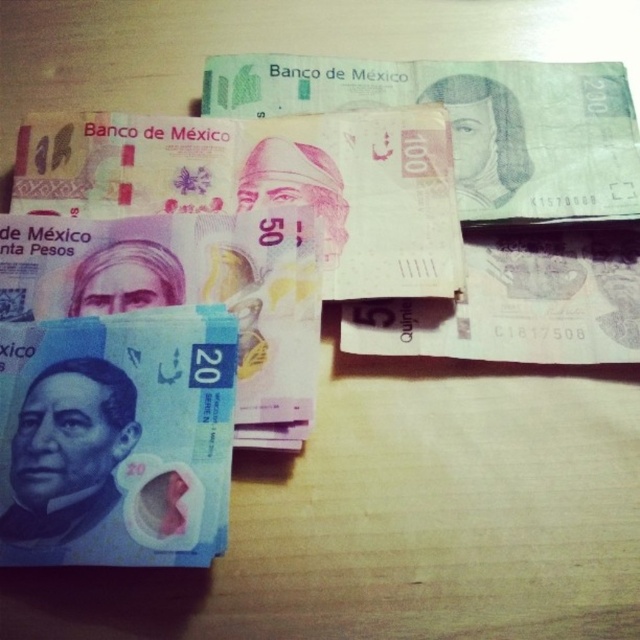
Question: Is blue paper currency at lower left above blue paper currency at left?

Choices:
 (A) yes
 (B) no

Answer: (B)

Question: Which point appears farthest from the camera in this image?

Choices:
 (A) coord(17,364)
 (B) coord(316,269)

Answer: (B)

Question: Which point is closer to the camera?

Choices:
 (A) (52, 384)
 (B) (314, 300)

Answer: (A)

Question: Is blue paper currency at lower left below blue paper currency at left?

Choices:
 (A) no
 (B) yes

Answer: (B)

Question: From the image, what is the correct spatial relationship of blue paper currency at lower left in relation to blue paper currency at left?

Choices:
 (A) below
 (B) above

Answer: (A)

Question: Which of the following is the closest to the observer?

Choices:
 (A) (260, 264)
 (B) (48, 356)

Answer: (B)